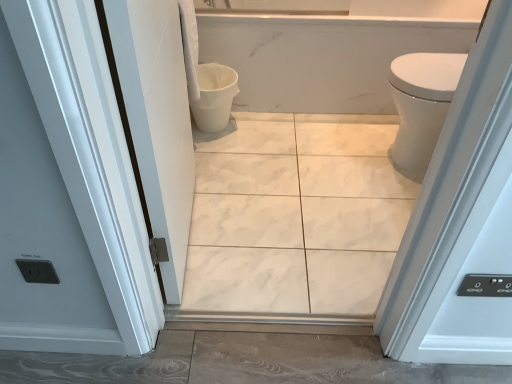
What do you see at coordinates (156, 119) in the screenshot? I see `white glossy door at left` at bounding box center [156, 119].

What is the approximate height of white marble tile at center?

It is 1.11 inches.

I want to click on white matte toilet bowl at center, so click(x=214, y=97).

The height and width of the screenshot is (384, 512). What do you see at coordinates (214, 97) in the screenshot?
I see `white matte toilet bowl at center` at bounding box center [214, 97].

Locate an element on the screen. The width and height of the screenshot is (512, 384). white glossy door at left is located at coordinates (156, 119).

Can you confirm if white matte toilet bowl at center is bigger than white marble tile at center?

No, white matte toilet bowl at center is not bigger than white marble tile at center.

From a real-world perspective, relative to white marble tile at center, is white matte toilet bowl at center vertically above or below?

Clearly, from a real-world perspective, white matte toilet bowl at center is above white marble tile at center.

Can you confirm if white matte toilet bowl at center is shorter than white marble tile at center?

Incorrect, the height of white matte toilet bowl at center does not fall short of that of white marble tile at center.

From a real-world perspective, is white glossy door at left above or below white glossy bidet at right?

Clearly, from a real-world perspective, white glossy door at left is above white glossy bidet at right.

Which is more to the right, white glossy door at left or white glossy bidet at right?

white glossy bidet at right is more to the right.

Who is smaller, white glossy door at left or white glossy bidet at right?

Smaller between the two is white glossy bidet at right.

Considering the sizes of white glossy door at left and white glossy bidet at right in the image, is white glossy door at left wider or thinner than white glossy bidet at right?

Considering their sizes, white glossy door at left looks slimmer than white glossy bidet at right.

The width and height of the screenshot is (512, 384). Find the location of `ceramic tile below the white glossy bidet at right (from the image's perspective)`. ceramic tile below the white glossy bidet at right (from the image's perspective) is located at coordinates (295, 214).

Considering the positions of points (243, 147) and (426, 85), is point (243, 147) closer to camera compared to point (426, 85)?

No, it is behind (426, 85).

In the scene shown: Does white glossy bidet at right turn towards white glossy door at left?

No, white glossy bidet at right is not aimed at white glossy door at left.

Consider the image. Which object is thinner, white glossy bidet at right or white glossy door at left?

Thinner between the two is white glossy door at left.

In the image, is white glossy bidet at right positioned in front of or behind white glossy door at left?

Visually, white glossy bidet at right is located behind white glossy door at left.

Can you tell me how much white glossy bidet at right and white glossy door at left differ in facing direction?

The facing directions of white glossy bidet at right and white glossy door at left are 178 degrees apart.

Is white glossy door at left not near white marble tile at center?

No, there isn't a large distance between white glossy door at left and white marble tile at center.

Choose the correct answer: Is white glossy door at left inside white marble tile at center or outside it?

white glossy door at left is outside white marble tile at center.

From the image's perspective, would you say white glossy door at left is positioned over white marble tile at center?

Yes, from the image's perspective, white glossy door at left is on top of white marble tile at center.

Which of these two, white matte toilet bowl at center or white glossy bidet at right, is bigger?

With larger size is white glossy bidet at right.

Is white matte toilet bowl at center aimed at white glossy bidet at right?

Yes.

Which is in front, point (217, 71) or point (416, 176)?

Positioned in front is point (416, 176).

From the image's perspective, is white matte toilet bowl at center above white glossy bidet at right?

Yes, from the image's perspective, white matte toilet bowl at center is over white glossy bidet at right.

Does white glossy bidet at right have a lesser width compared to white matte toilet bowl at center?

Incorrect, the width of white glossy bidet at right is not less than that of white matte toilet bowl at center.

Between white glossy bidet at right and white matte toilet bowl at center, which one has more height?

white glossy bidet at right.

Are white glossy bidet at right and white matte toilet bowl at center located far from each other?

That's not correct — white glossy bidet at right is a little close to white matte toilet bowl at center.

In the scene shown: From a real-world perspective, is white glossy bidet at right physically located above or below white matte toilet bowl at center?

Clearly, from a real-world perspective, white glossy bidet at right is above white matte toilet bowl at center.

Image resolution: width=512 pixels, height=384 pixels. Find the location of `toilet bowl located above the white marble tile at center (from a real-world perspective)`. toilet bowl located above the white marble tile at center (from a real-world perspective) is located at coordinates (214, 97).

Identify the location of screen door in front of the white glossy bidet at right. This screenshot has width=512, height=384. [156, 119].

Estimate the real-world distances between objects in this image. Which object is closer to white glossy bidet at right, white matte toilet bowl at center or white glossy door at left?

white matte toilet bowl at center is positioned closer to the anchor white glossy bidet at right.

Which object lies further to the anchor point white glossy bidet at right, white glossy door at left or white matte toilet bowl at center?

Based on the image, white glossy door at left appears to be further to white glossy bidet at right.

Which object lies further to the anchor point white matte toilet bowl at center, white glossy bidet at right or white glossy door at left?

Based on the image, white glossy bidet at right appears to be further to white matte toilet bowl at center.

Considering their positions, is white marble tile at center positioned further to white glossy door at left than white matte toilet bowl at center?

white matte toilet bowl at center lies further to white glossy door at left than the other object.

Which object lies further to the anchor point white marble tile at center, white glossy bidet at right or white matte toilet bowl at center?

white matte toilet bowl at center is positioned further to the anchor white marble tile at center.

Looking at the image, which one is located closer to white glossy door at left, white matte toilet bowl at center or white glossy bidet at right?

The object closer to white glossy door at left is white matte toilet bowl at center.

Looking at the image, which one is located closer to white matte toilet bowl at center, white marble tile at center or white glossy bidet at right?

white marble tile at center is closer to white matte toilet bowl at center.

Looking at the image, which one is located closer to white glossy door at left, white glossy bidet at right or white matte toilet bowl at center?

Based on the image, white matte toilet bowl at center appears to be nearer to white glossy door at left.

This screenshot has height=384, width=512. What are the coordinates of `bidet between white glossy door at left and white matte toilet bowl at center in the front-back direction` in the screenshot? It's located at (421, 105).

The width and height of the screenshot is (512, 384). Identify the location of ceramic tile between white matte toilet bowl at center and white glossy bidet at right. (295, 214).

Locate an element on the screen. The width and height of the screenshot is (512, 384). ceramic tile between white glossy door at left and white glossy bidet at right from left to right is located at coordinates (295, 214).

Locate an element on the screen. ceramic tile located between white glossy door at left and white matte toilet bowl at center in the depth direction is located at coordinates (295, 214).